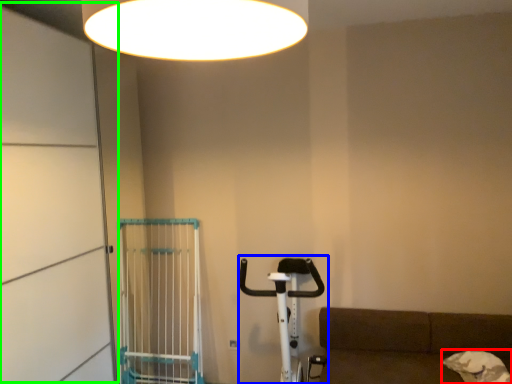
Question: Estimate the real-world distances between objects in this image. Which object is farther from dog (highlighted by a red box), baby carriage (highlighted by a blue box) or screen door (highlighted by a green box)?

Choices:
 (A) baby carriage
 (B) screen door

Answer: (B)